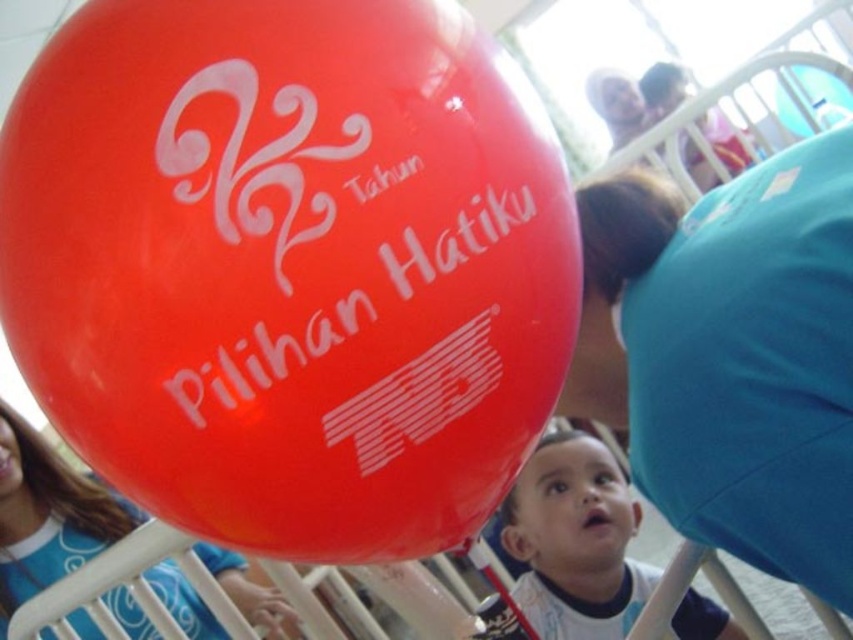
Can you confirm if glossy rubber balloon at upper left is positioned above matte blue shirt at lower left?

Indeed, glossy rubber balloon at upper left is positioned over matte blue shirt at lower left.

Is point (94, 413) positioned behind point (231, 580)?

No.

Where is `glossy rubber balloon at upper left`? The width and height of the screenshot is (853, 640). glossy rubber balloon at upper left is located at coordinates (289, 266).

Is glossy rubber balloon at upper left below smooth skin baby at center?

No, glossy rubber balloon at upper left is not below smooth skin baby at center.

Where is `glossy rubber balloon at upper left`? This screenshot has width=853, height=640. glossy rubber balloon at upper left is located at coordinates (289, 266).

The width and height of the screenshot is (853, 640). What are the coordinates of `glossy rubber balloon at upper left` in the screenshot? It's located at (289, 266).

Based on the photo, which is below, smooth skin baby at center or matte blue shirt at lower left?

smooth skin baby at center is lower down.

Is point (708, 611) positioned behind point (248, 618)?

No, it is in front of (248, 618).

Is point (526, 506) positioned in front of point (38, 536)?

Yes, point (526, 506) is closer to viewer.

Locate an element on the screen. smooth skin baby at center is located at coordinates (573, 540).